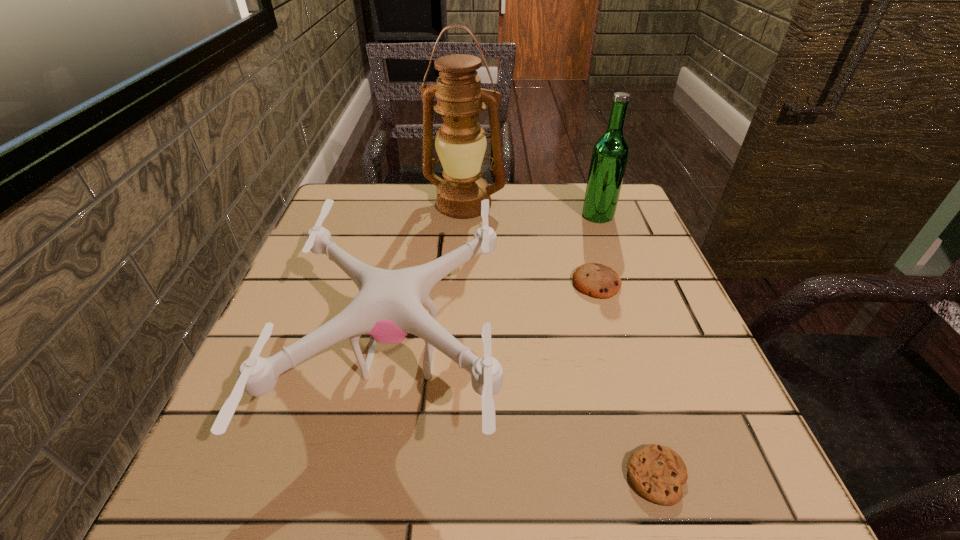
Find the location of a particular element. This screenshot has width=960, height=540. object that is at the near right corner is located at coordinates (657, 472).

Find the location of `free space at the far edge`. free space at the far edge is located at coordinates (444, 230).

In the image, there is a desktop. In order to click on free space at the near edge in this screenshot , I will do `click(526, 461)`.

Image resolution: width=960 pixels, height=540 pixels. In the image, there is a desktop. Find the location of `free space at the left edge`. free space at the left edge is located at coordinates (358, 254).

Locate an element on the screen. The height and width of the screenshot is (540, 960). vacant position at the right edge of the desktop is located at coordinates (652, 281).

This screenshot has width=960, height=540. What are the coordinates of `free space at the far left corner of the desktop` in the screenshot? It's located at (342, 207).

Locate an element on the screen. This screenshot has height=540, width=960. vacant space at the far right corner of the desktop is located at coordinates (630, 211).

Identify the location of free space between the drone and the beer bottle. (499, 286).

Locate an element on the screen. unoccupied position between the shorter cookie and the second tallest object is located at coordinates (627, 346).

Locate an element on the screen. The width and height of the screenshot is (960, 540). vacant region between the nearer cookie and the taller cookie is located at coordinates (x=626, y=380).